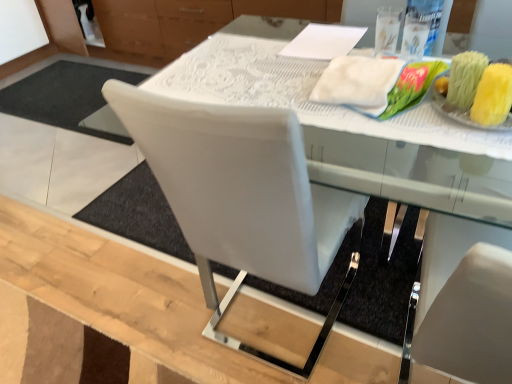
Where is `free space that is to the left of white leather chair at center`? Image resolution: width=512 pixels, height=384 pixels. free space that is to the left of white leather chair at center is located at coordinates (131, 300).